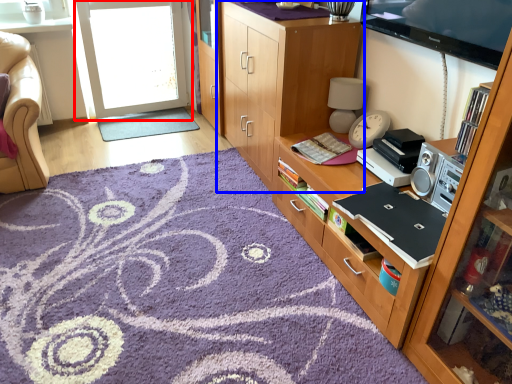
Question: Which object appears closest to the camera in this image, screen door (highlighted by a red box) or cabinetry (highlighted by a blue box)?

Choices:
 (A) screen door
 (B) cabinetry

Answer: (B)